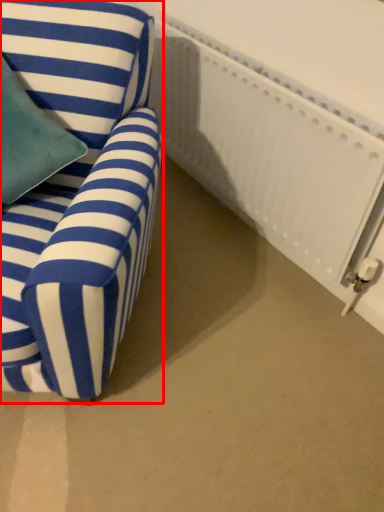
Question: From the image's perspective, where is chair (annotated by the red box) located in relation to radiator in the image?

Choices:
 (A) above
 (B) below

Answer: (B)